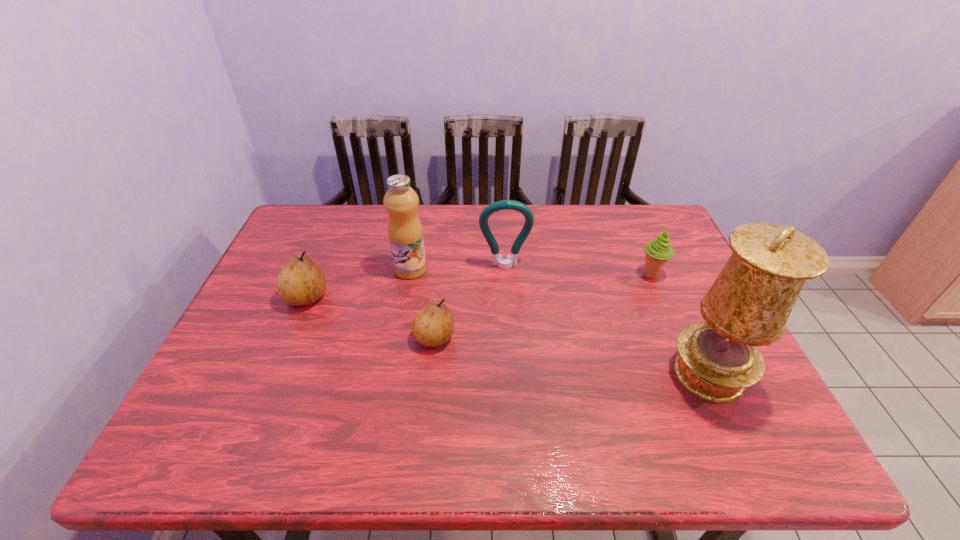
Locate an element on the screen. The width and height of the screenshot is (960, 540). free space that satisfies the following two spatial constraints: 1. on the front label of the second tallest object; 2. on the right side of the shortest object is located at coordinates (398, 338).

Find the location of a particular element. The height and width of the screenshot is (540, 960). free space that satisfies the following two spatial constraints: 1. at the jaws of the third tallest object; 2. on the left side of the oil lamp is located at coordinates (512, 374).

Locate an element on the screen. This screenshot has height=540, width=960. free space that satisfies the following two spatial constraints: 1. on the front label of the icecream; 2. on the right side of the second tallest object is located at coordinates (410, 275).